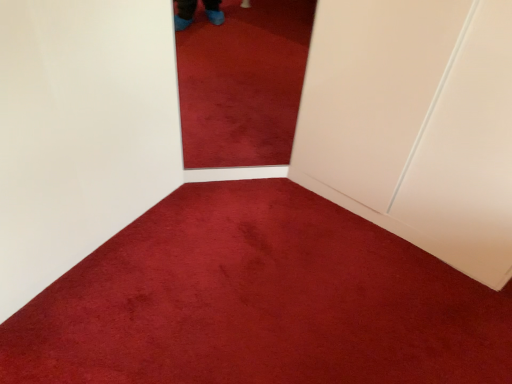
Locate an element on the screen. This screenshot has width=512, height=384. white matte door at right is located at coordinates (415, 124).

Describe the element at coordinates (415, 124) in the screenshot. The height and width of the screenshot is (384, 512). I see `white matte door at right` at that location.

Find the location of a particular element. This screenshot has height=384, width=512. velvety red carpet at center is located at coordinates (259, 301).

What do you see at coordinates (259, 301) in the screenshot? I see `velvety red carpet at center` at bounding box center [259, 301].

You are a GUI agent. You are given a task and a screenshot of the screen. Output one action in this format:
    pyautogui.click(x=<x>, y=<y>)
    Task: Click on the white matte door at right
    Image resolution: width=512 pixels, height=384 pixels.
    Given the screenshot: What is the action you would take?
    (415, 124)

Which is more to the right, velvety red carpet at center or white matte door at right?

white matte door at right.

Between velvety red carpet at center and white matte door at right, which one is positioned behind?

white matte door at right is behind.

Which is more distant, (x=252, y=272) or (x=434, y=171)?

The point (x=252, y=272) is behind.

From the image's perspective, is velvety red carpet at center below white matte door at right?

Indeed, from the image's perspective, velvety red carpet at center is shown beneath white matte door at right.

From a real-world perspective, is velvety red carpet at center under white matte door at right?

Yes, from a real-world perspective, velvety red carpet at center is below white matte door at right.

In terms of width, does velvety red carpet at center look wider or thinner when compared to white matte door at right?

In the image, velvety red carpet at center appears to be wider than white matte door at right.

Between velvety red carpet at center and white matte door at right, which one has less height?

velvety red carpet at center is shorter.

Considering the relative sizes of velvety red carpet at center and white matte door at right in the image provided, is velvety red carpet at center smaller than white matte door at right?

Yes.

Is velvety red carpet at center outside of white matte door at right?

Yes, velvety red carpet at center is outside of white matte door at right.

Is there a large distance between velvety red carpet at center and white matte door at right?

velvety red carpet at center is near white matte door at right, not far away.

Does velvety red carpet at center turn towards white matte door at right?

No, velvety red carpet at center is not oriented towards white matte door at right.

You are a GUI agent. You are given a task and a screenshot of the screen. Output one action in this format:
    pyautogui.click(x=<x>, y=<y>)
    Task: Click on the plain below the white matte door at right (from a real-world perspective)
    The width and height of the screenshot is (512, 384).
    Given the screenshot: What is the action you would take?
    pyautogui.click(x=259, y=301)

Is white matte door at right to the left of velvety red carpet at center from the viewer's perspective?

Incorrect, white matte door at right is not on the left side of velvety red carpet at center.

Is white matte door at right positioned in front of velvety red carpet at center?

No, the depth of white matte door at right is greater than that of velvety red carpet at center.

Is point (488, 184) closer to camera compared to point (322, 239)?

Yes, it is in front of point (322, 239).

From the image's perspective, is white matte door at right positioned above or below velvety red carpet at center?

Based on their image positions, white matte door at right is located above velvety red carpet at center.

Looking at this image, from a real-world perspective, which object stands above the other?

From a 3D spatial view, white matte door at right is above.

Which of these two, white matte door at right or velvety red carpet at center, is thinner?

white matte door at right.

Considering the relative sizes of white matte door at right and velvety red carpet at center in the image provided, is white matte door at right taller than velvety red carpet at center?

Yes, white matte door at right is taller than velvety red carpet at center.

Based on their sizes in the image, would you say white matte door at right is bigger or smaller than velvety red carpet at center?

Clearly, white matte door at right is larger in size than velvety red carpet at center.

Is white matte door at right surrounding velvety red carpet at center?

No, velvety red carpet at center is not a part of white matte door at right.

Is white matte door at right next to velvety red carpet at center and touching it?

No, white matte door at right is not in contact with velvety red carpet at center.

Is white matte door at right facing towards velvety red carpet at center?

Yes, white matte door at right is aimed at velvety red carpet at center.

How different are the orientations of white matte door at right and velvety red carpet at center in degrees?

They differ by 90.3 degrees in their facing directions.

Locate an element on the screen. plain that is under the white matte door at right (from a real-world perspective) is located at coordinates (259, 301).

Where is `door that is behind the velvety red carpet at center`? This screenshot has width=512, height=384. door that is behind the velvety red carpet at center is located at coordinates (415, 124).

At what (x,y) coordinates should I click in order to perform the action: click on plain that appears below the white matte door at right (from the image's perspective). Please return your answer as a coordinate pair (x, y). The height and width of the screenshot is (384, 512). Looking at the image, I should click on (259, 301).